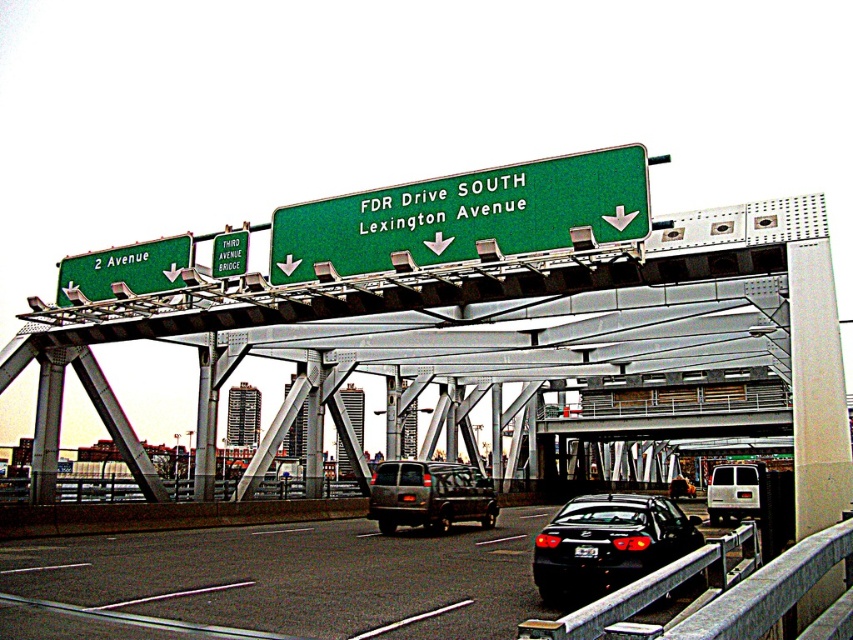
Who is higher up, green matte highway sign at center or green matte sign at upper left?

Positioned higher is green matte highway sign at center.

Does green matte highway sign at center appear on the left side of green matte sign at upper left?

In fact, green matte highway sign at center is to the right of green matte sign at upper left.

Image resolution: width=853 pixels, height=640 pixels. What are the coordinates of `green matte highway sign at center` in the screenshot? It's located at (466, 216).

Does green matte highway sign at center appear on the right side of white matte van at center?

In fact, green matte highway sign at center is to the left of white matte van at center.

How much distance is there between green matte highway sign at center and white matte van at center?

They are 23.40 meters apart.

I want to click on green matte highway sign at center, so click(x=466, y=216).

Consider the image. Between matte gray suv at center and green matte sign at upper center, which one has less height?

With less height is matte gray suv at center.

Where is `matte gray suv at center`? This screenshot has height=640, width=853. matte gray suv at center is located at coordinates (430, 496).